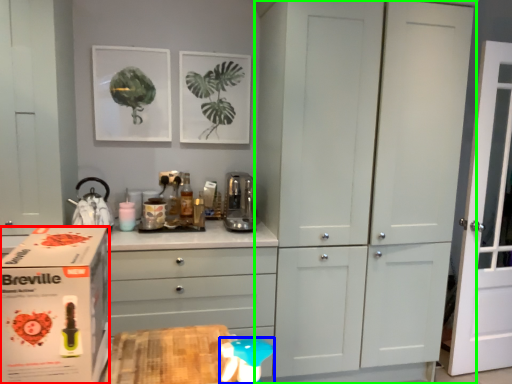
Question: Which is farther away from cardboard box (highlighted by a red box)? toy (highlighted by a blue box) or cupboard (highlighted by a green box)?

Choices:
 (A) toy
 (B) cupboard

Answer: (B)